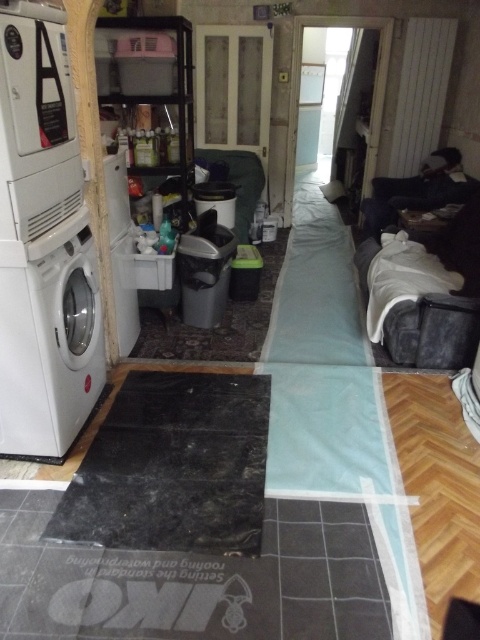
Question: Can you confirm if white glossy washing machine at left is smaller than velvet grey sofa at right?

Choices:
 (A) no
 (B) yes

Answer: (B)

Question: Which of the following is the farthest from the observer?

Choices:
 (A) (377, 240)
 (B) (54, 312)

Answer: (A)

Question: Does white glossy washing machine at left have a greater width compared to velvet grey sofa at right?

Choices:
 (A) no
 (B) yes

Answer: (A)

Question: In this image, where is white glossy washing machine at left located relative to velvet grey sofa at right?

Choices:
 (A) below
 (B) above

Answer: (A)

Question: Which of the following is the closest to the observer?

Choices:
 (A) (12, 388)
 (B) (477, 294)

Answer: (A)

Question: Among these objects, which one is farthest from the camera?

Choices:
 (A) white glossy washing machine at left
 (B) velvet grey sofa at right

Answer: (B)